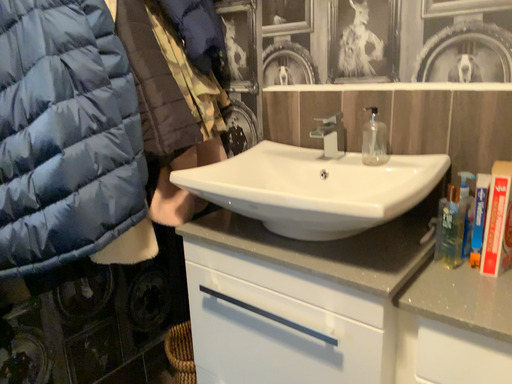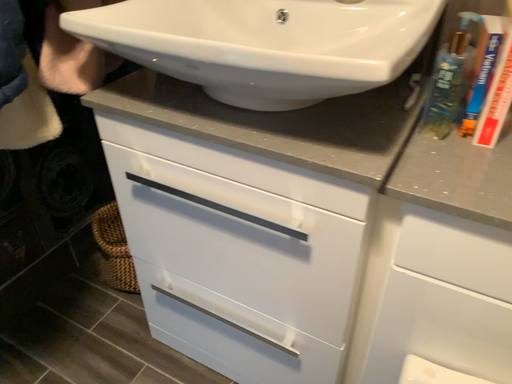
Question: Which way did the camera rotate in the video?

Choices:
 (A) rotated left
 (B) rotated right

Answer: (B)